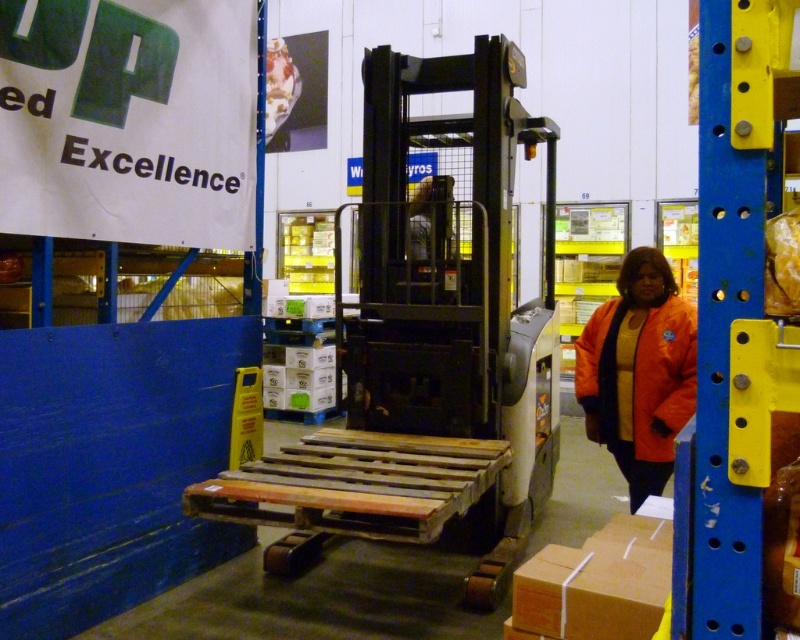
Is point (529, 500) less distant than point (678, 342)?

No, it is not.

Where is `metallic forklift at center`? This screenshot has height=640, width=800. metallic forklift at center is located at coordinates (428, 340).

The image size is (800, 640). Find the location of `metallic forklift at center`. metallic forklift at center is located at coordinates (428, 340).